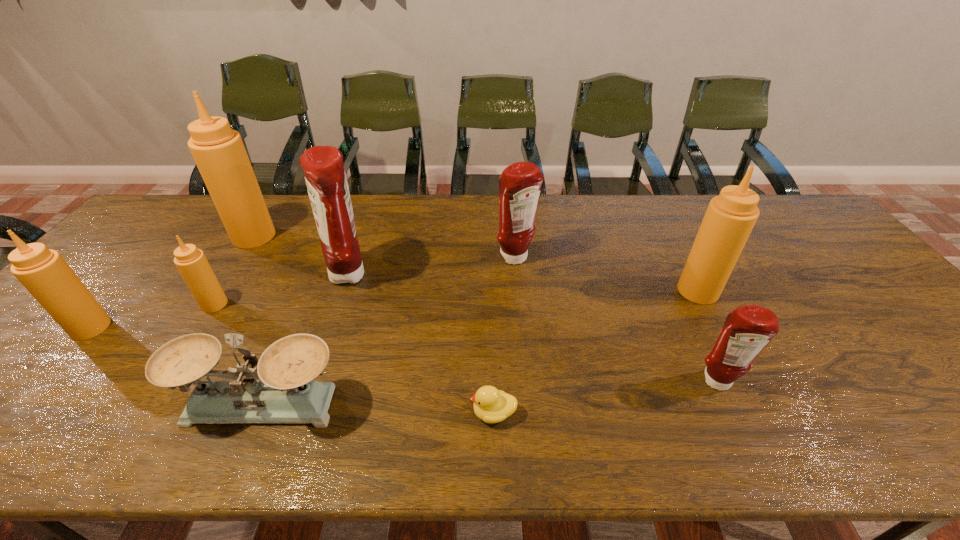
Locate an element on the screen. This screenshot has height=540, width=960. free space that satisfies the following two spatial constraints: 1. on the front side of the rightmost red condiment; 2. on the beak of the duckling is located at coordinates (732, 413).

Where is `vacant position in the image that satisfies the following two spatial constraints: 1. on the back side of the fourth condiment from right to left; 2. on the left side of the smallest tan condiment`? This screenshot has height=540, width=960. vacant position in the image that satisfies the following two spatial constraints: 1. on the back side of the fourth condiment from right to left; 2. on the left side of the smallest tan condiment is located at coordinates (232, 275).